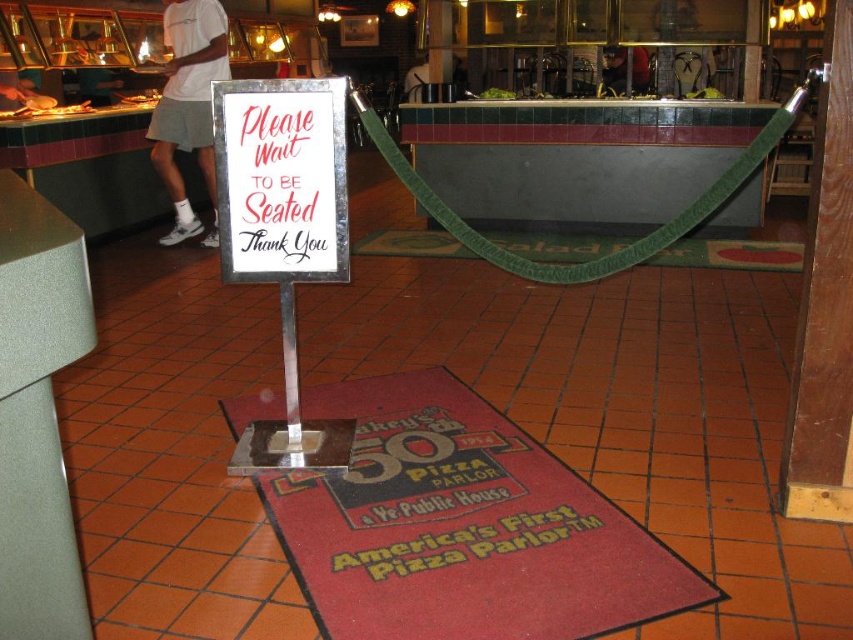
You are a customer at Dickey s Pizza Parlor and want to sit down. You see a red rubber mat at center and a green fabric rope at center. How far apart are these two items from each other?

The red rubber mat at center is 9.48 feet from the green fabric rope at center.